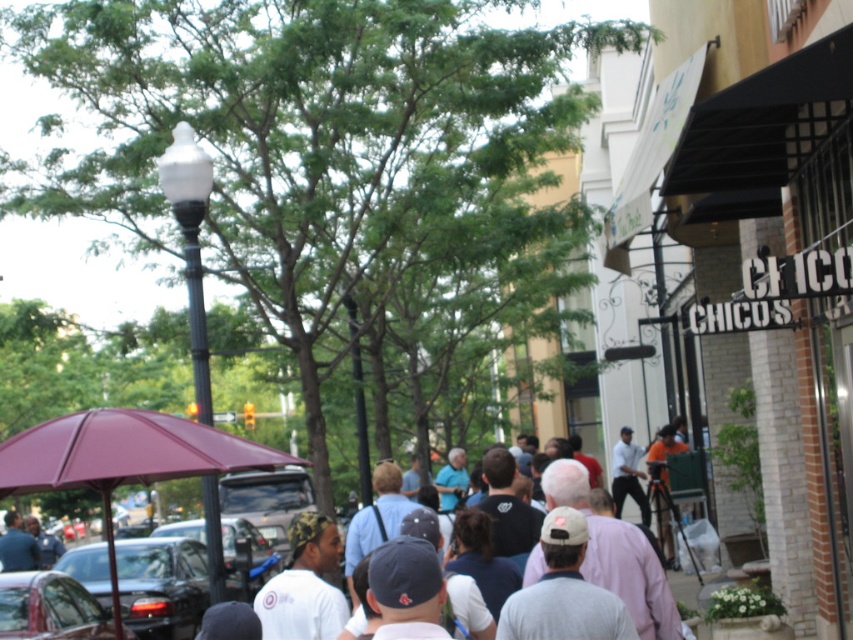
You are a pedestrian standing at the edge of the street where the shiny black car at lower left and the metallic gray car at center are parked. You need to cross the street to reach the trees on the opposite side. Which car should you walk around to safely cross without going into the road?

You should walk around the shiny black car at lower left because it is positioned to the left of the metallic gray car at center, so staying near it keeps you closer to the sidewalk and away from the road.

You are a delivery driver who needs to park your truck, which is 6 meters long, in this area. The shiny black car at lower left and the metallic gray car at center are blocking the parking spot. Can you fit your truck between them?

The shiny black car at lower left is larger in size than metallic gray car at center. However, the distance between them isn not provided in the description, so it cannot be determined if the truck can fit.